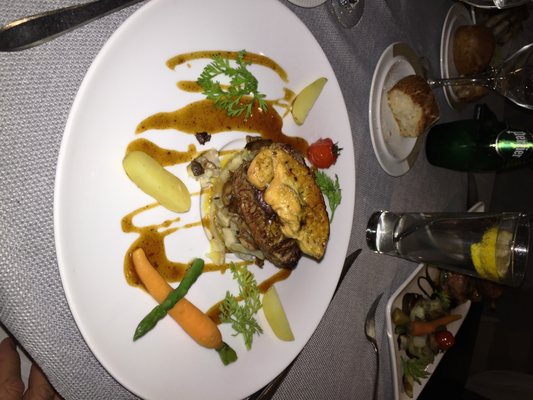
At what (x,y) coordinates should I click in order to perform the action: click on platter. Please return your answer as a coordinate pair (x, y). The image size is (533, 400). Looking at the image, I should click on (400, 301).